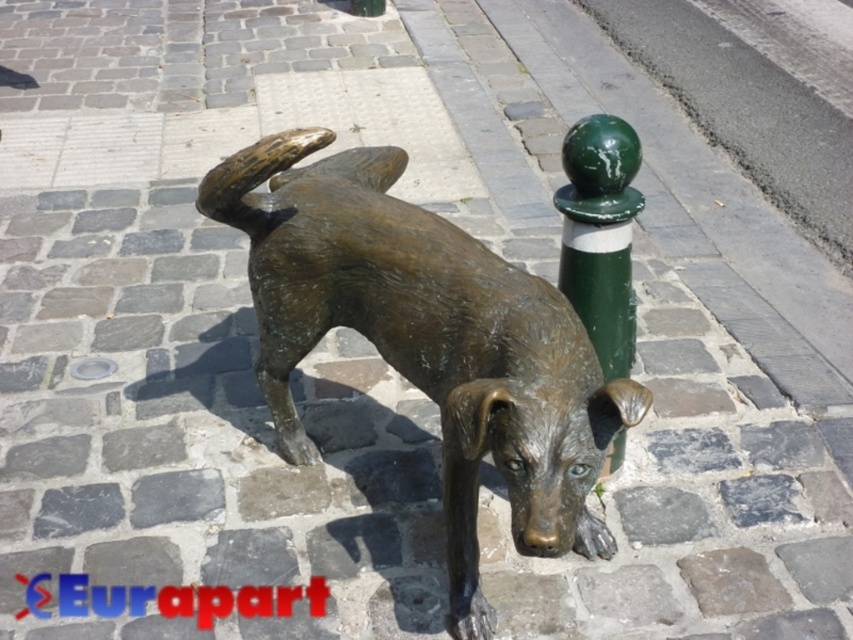
Question: Which object is closer to the camera taking this photo?

Choices:
 (A) green painted metal pole at upper right
 (B) bronze statue at center

Answer: (B)

Question: Does bronze statue at center appear on the left side of green painted metal pole at upper right?

Choices:
 (A) yes
 (B) no

Answer: (A)

Question: Does bronze statue at center have a larger size compared to green painted metal pole at upper right?

Choices:
 (A) yes
 (B) no

Answer: (A)

Question: Does bronze statue at center appear on the left side of green painted metal pole at upper right?

Choices:
 (A) yes
 (B) no

Answer: (A)

Question: Which object is closer to the camera taking this photo?

Choices:
 (A) green painted metal pole at upper right
 (B) bronze statue at center

Answer: (B)